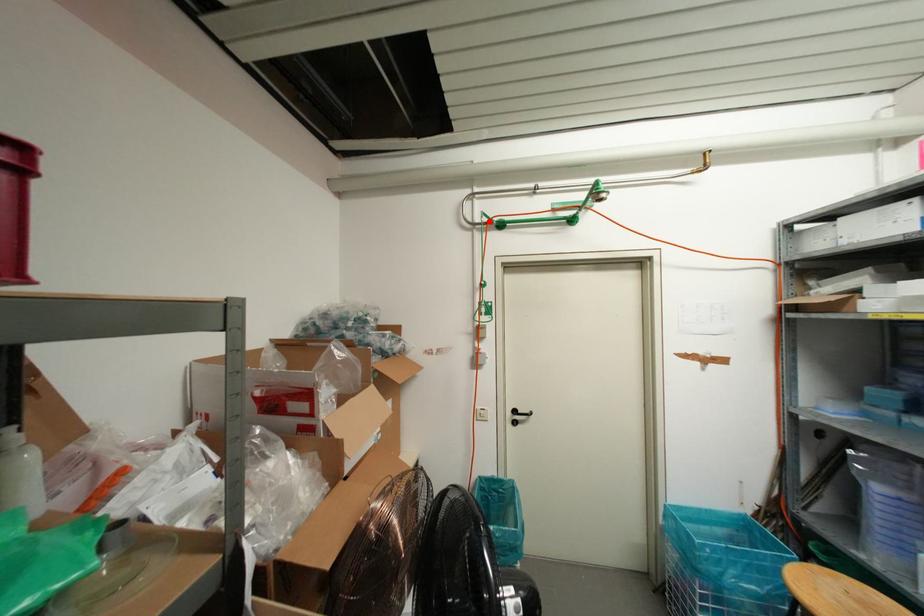
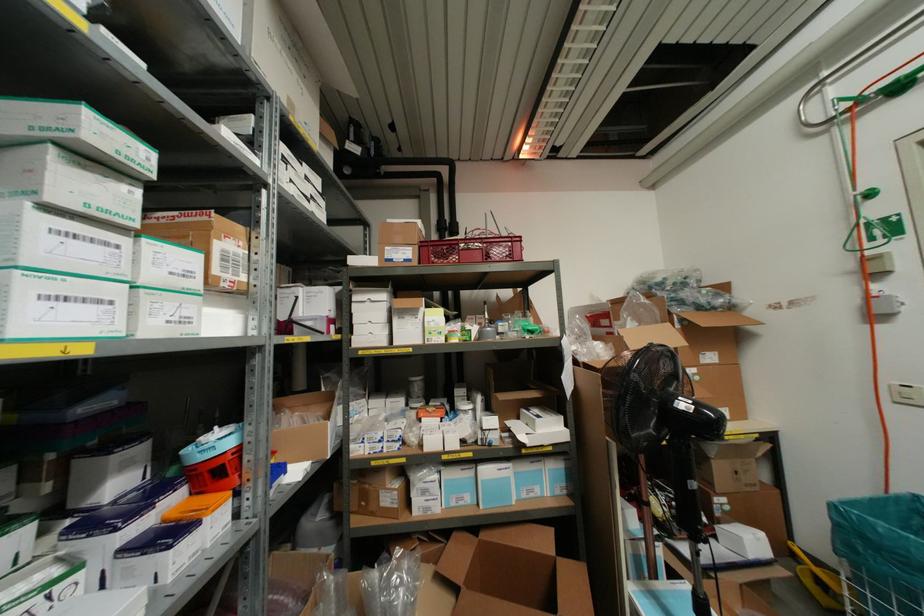
Find the pixel in the second image that matches the highlighted location in the first image.

(859, 100)